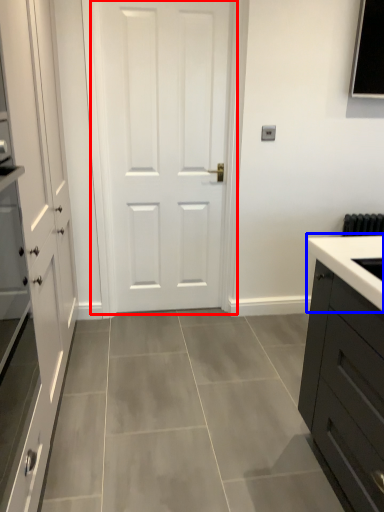
Question: Which object is closer to the camera taking this photo, door (highlighted by a red box) or sink (highlighted by a blue box)?

Choices:
 (A) door
 (B) sink

Answer: (A)